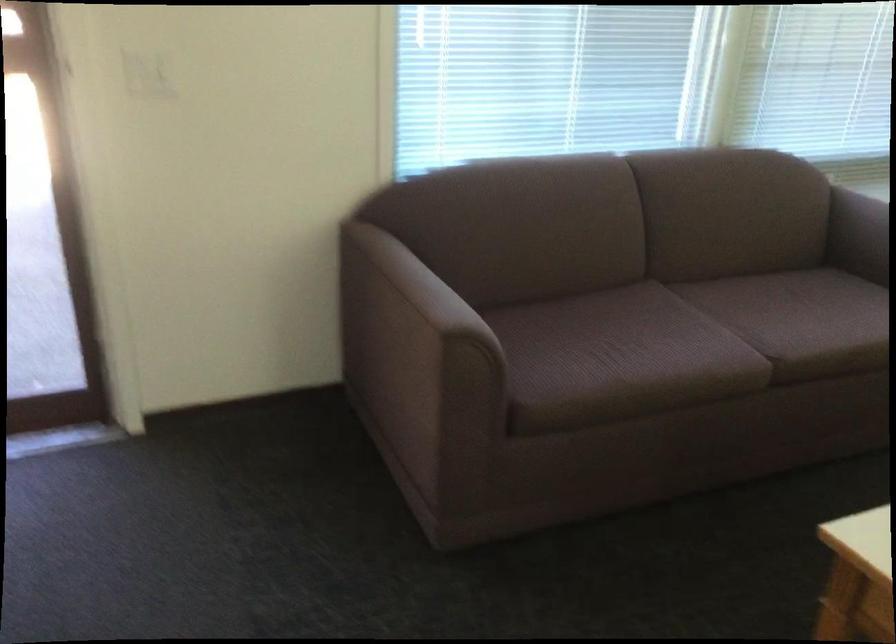
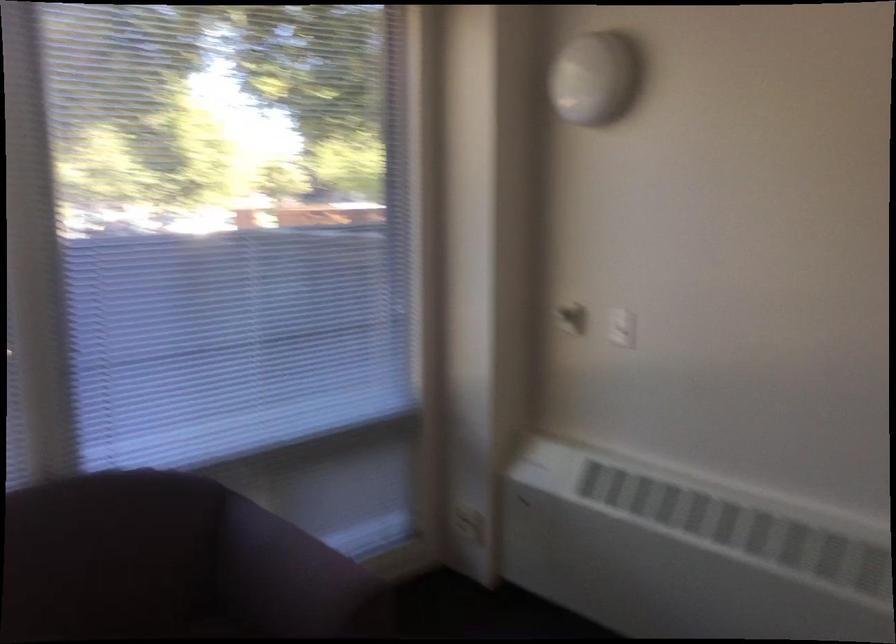
Question: The images are taken continuously from a first-person perspective. In which direction are you moving?

Choices:
 (A) Left
 (B) Right
 (C) Forward
 (D) Backward

Answer: (B)